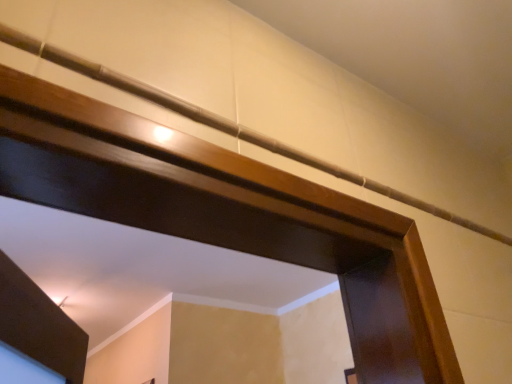
You are a GUI agent. You are given a task and a screenshot of the screen. Output one action in this format:
    pyautogui.click(x=<x>, y=<y>)
    Task: Click on the brown polished wood beam at upper center
    
    Given the screenshot: What is the action you would take?
    pyautogui.click(x=223, y=124)

The width and height of the screenshot is (512, 384). What do you see at coordinates (223, 124) in the screenshot? I see `brown polished wood beam at upper center` at bounding box center [223, 124].

What is the approximate width of brown polished wood beam at upper center?

0.87 inches.

You are a GUI agent. You are given a task and a screenshot of the screen. Output one action in this format:
    pyautogui.click(x=<x>, y=<y>)
    Task: Click on the brown polished wood beam at upper center
    
    Given the screenshot: What is the action you would take?
    pyautogui.click(x=223, y=124)